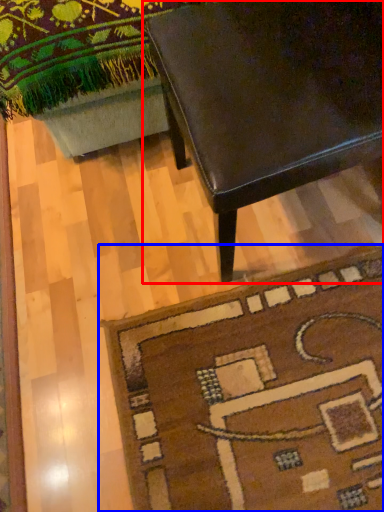
Question: Which point is closer to the camera, table (highlighted by a red box) or mat (highlighted by a blue box)?

Choices:
 (A) table
 (B) mat

Answer: (A)